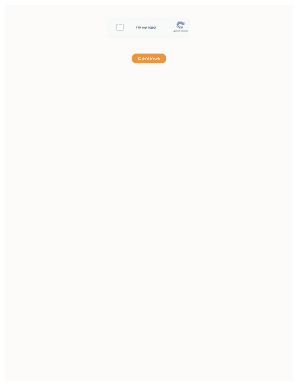
The height and width of the screenshot is (386, 298). Identify the location of empty box. (120, 26).